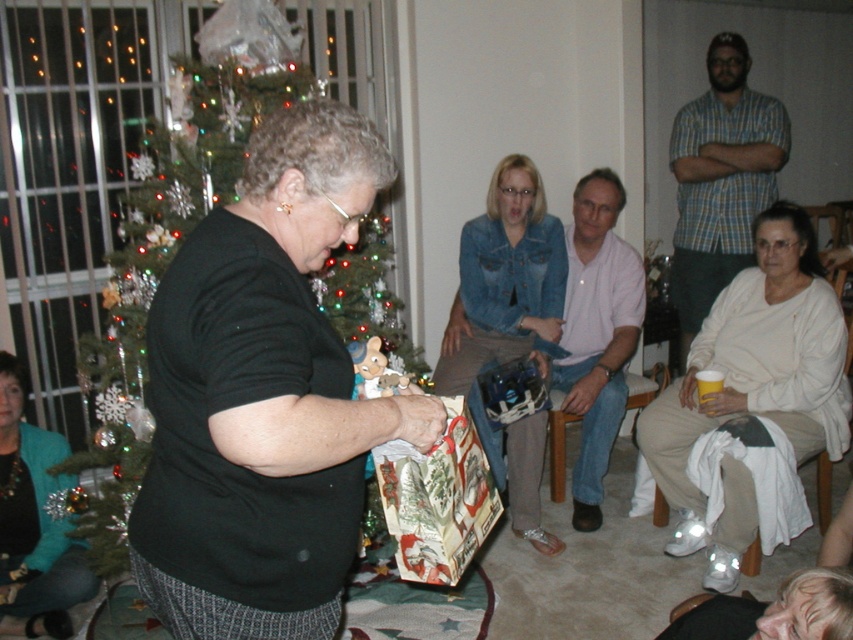
You are standing at the location of the camera in the scene. You want to hand the pink cotton shirt at center to someone across the room. Do you think you can throw it without needing to move closer?

The pink cotton shirt at center and camera are 3.28 meters apart. Throwing an object 3.28 meters might be challenging for most people without moving closer, so it is advisable to move closer to ensure accuracy and avoid potential injury.

You are helping to organize a holiday gift wrapping station. You have a pink cotton shirt at center and a printed paper bag at center. Which item should you place on the higher shelf to ensure they are stacked properly according to their sizes?

The pink cotton shirt at center is taller than the printed paper bag at center, so you should place the pink cotton shirt at center on the higher shelf to accommodate its greater height.